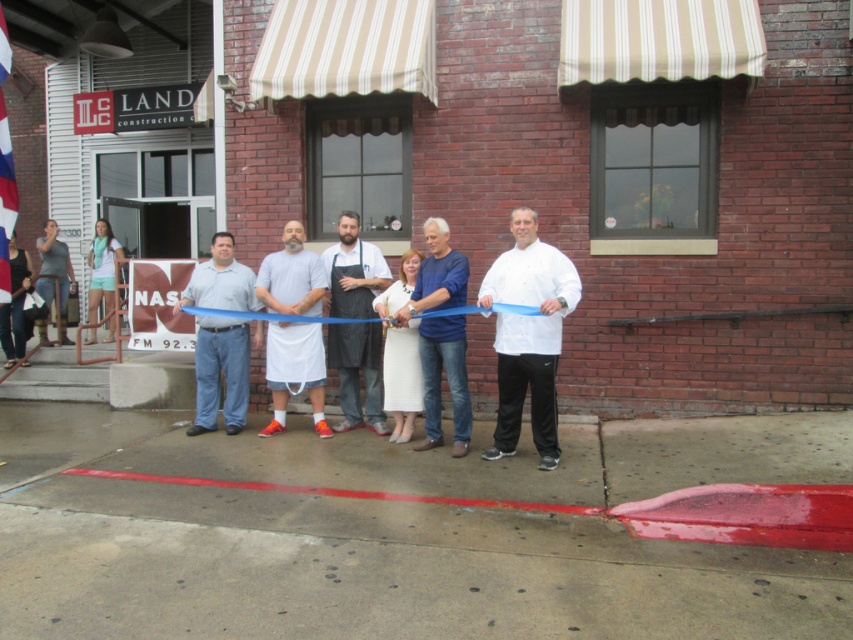
Question: Estimate the real-world distances between objects in this image. Which object is farther from the white matte apron at center?

Choices:
 (A) white fabric apron at center
 (B) white matte chef coat at center
 (C) gray cotton shirt at center
 (D) blue cotton shirt at center

Answer: (B)

Question: Which object appears closest to the camera in this image?

Choices:
 (A) white matte apron at center
 (B) gray cotton shirt at center
 (C) white fabric apron at center
 (D) white matte chef coat at center

Answer: (D)

Question: Which object is closer to the camera taking this photo?

Choices:
 (A) white matte chef coat at center
 (B) blue cotton shirt at center
 (C) white matte apron at center

Answer: (A)

Question: Observing the image, what is the correct spatial positioning of gray cotton shirt at center in reference to blue cotton shirt at center?

Choices:
 (A) below
 (B) above

Answer: (B)

Question: Does white matte chef coat at center have a smaller size compared to blue cotton shirt at center?

Choices:
 (A) yes
 (B) no

Answer: (B)

Question: Does white matte chef coat at center have a greater width compared to blue cotton shirt at center?

Choices:
 (A) no
 (B) yes

Answer: (B)